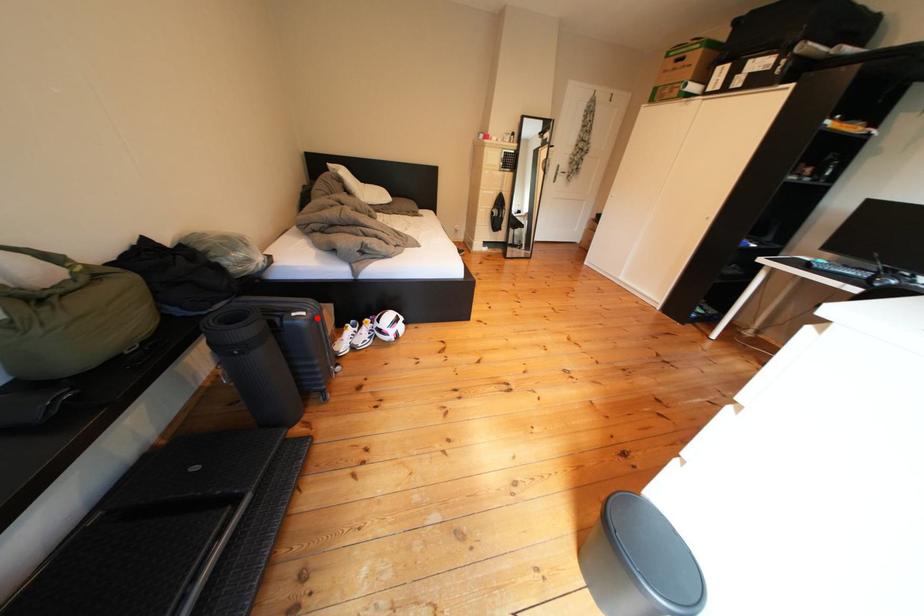
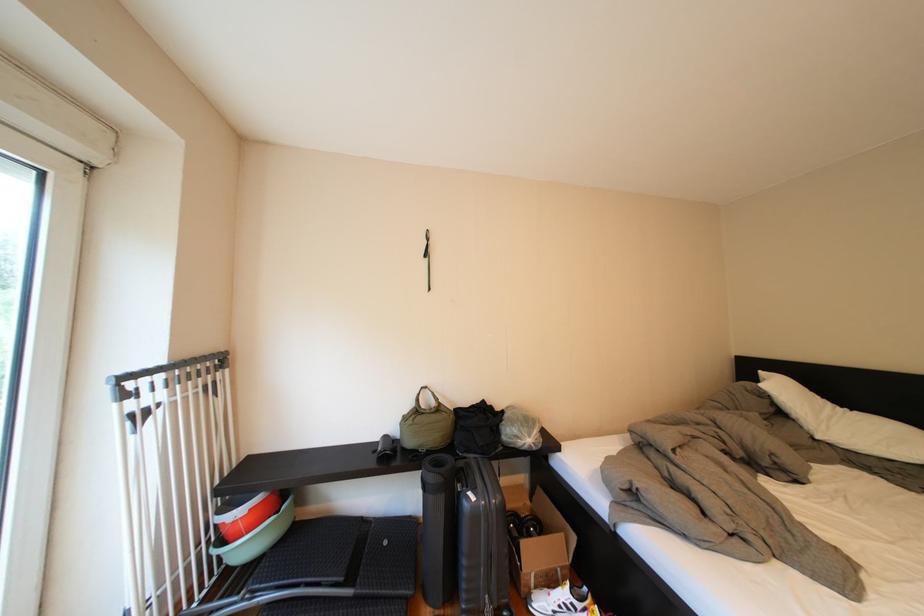
Question: I am providing you with two images of the same scene from different viewpoints. Given a red point in image1, look at the same physical point in image2. Is it:

Choices:
 (A) Closer to the viewpoint
 (B) Farther from the viewpoint

Answer: (B)